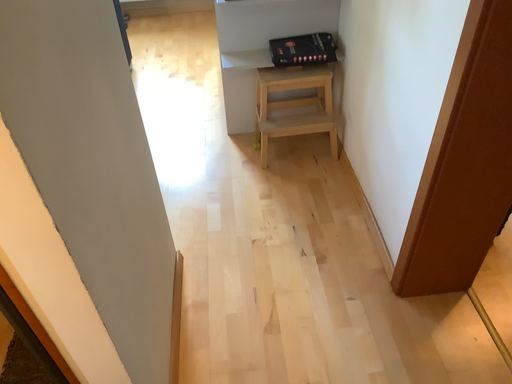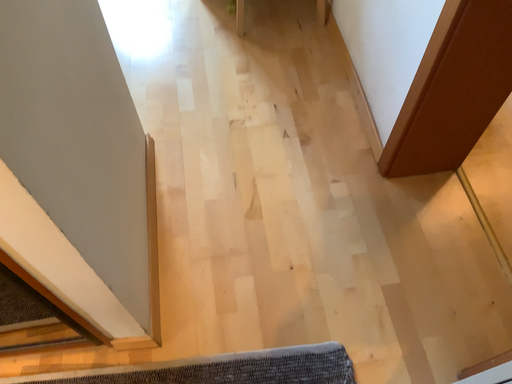
Question: Which way did the camera rotate in the video?

Choices:
 (A) rotated upward
 (B) rotated downward

Answer: (B)